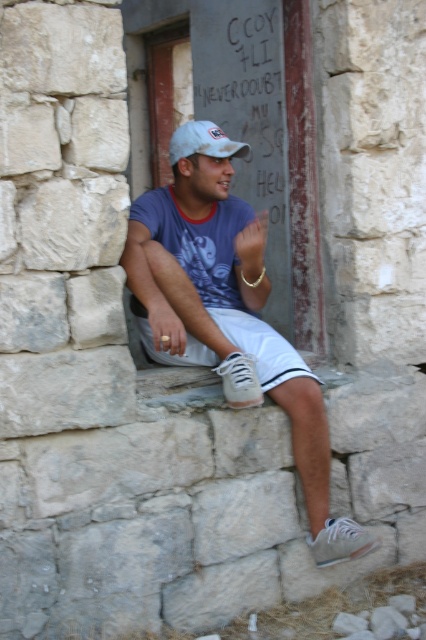
Question: Does white matte sneakers at lower center have a smaller size compared to white matte cap at center?

Choices:
 (A) no
 (B) yes

Answer: (A)

Question: Among these points, which one is farthest from the camera?

Choices:
 (A) (261, 68)
 (B) (173, 154)
 (C) (279, 348)

Answer: (A)

Question: Can you confirm if white matte sneakers at lower center is thinner than white matte cap at center?

Choices:
 (A) no
 (B) yes

Answer: (A)

Question: Which is farther from the white matte sneakers at lower center?

Choices:
 (A) white matte cap at center
 (B) white cotton shorts at center

Answer: (A)

Question: Which point is closer to the camera taking this photo?

Choices:
 (A) (261, 321)
 (B) (249, 236)

Answer: (B)

Question: Observing the image, what is the correct spatial positioning of white matte sneakers at lower center in reference to black chalk writing at center?

Choices:
 (A) above
 (B) below

Answer: (B)